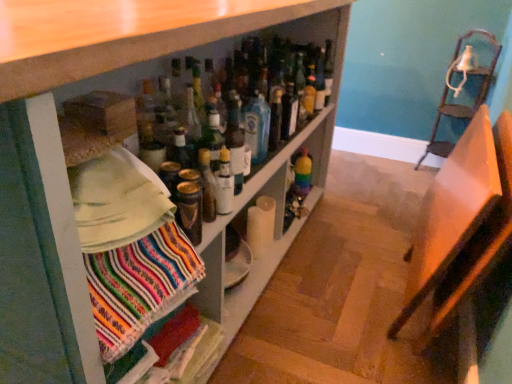
Question: Considering their positions, is wooden chair at right, the second chair positioned from the right, located in front of or behind blue glass bottle at center?

Choices:
 (A) behind
 (B) front

Answer: (B)

Question: From a real-world perspective, is wooden chair at right, the first chair when ordered from front to back, positioned above or below blue glass bottle at center?

Choices:
 (A) above
 (B) below

Answer: (B)

Question: Based on their relative distances, which object is farther from the rainbow glass bottle at center, the 4th bottle viewed from the front?

Choices:
 (A) wooden chair at right, the second chair positioned from the right
 (B) blue glass bottle at center
 (C) metallic gold can at center, which is the fourth bottle in right-to-left order
 (D) matte white shelf at center
 (E) metallic silver chair at upper right, the first chair in the right-to-left sequence

Answer: (D)

Question: Which is nearer to the blue glass bottle at center?

Choices:
 (A) wooden chair at right, the second chair positioned from the right
 (B) clear glass bottle at center, which is the second bottle from left to right
 (C) matte white shelf at center
 (D) metallic gold can at center, which is counted as the first bottle, starting from the left
 (E) black glass bottle at center, which ranks as the second bottle in back-to-front order

Answer: (E)